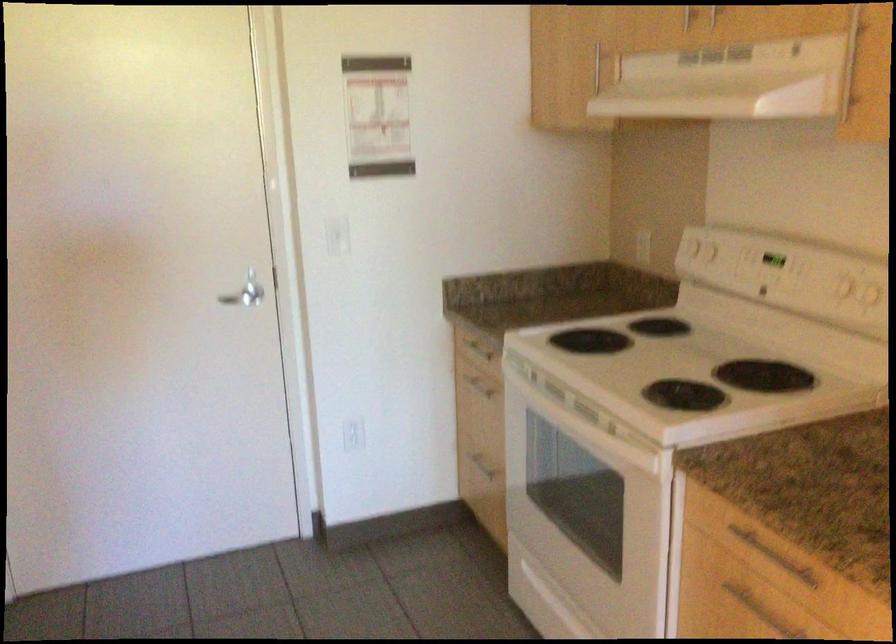
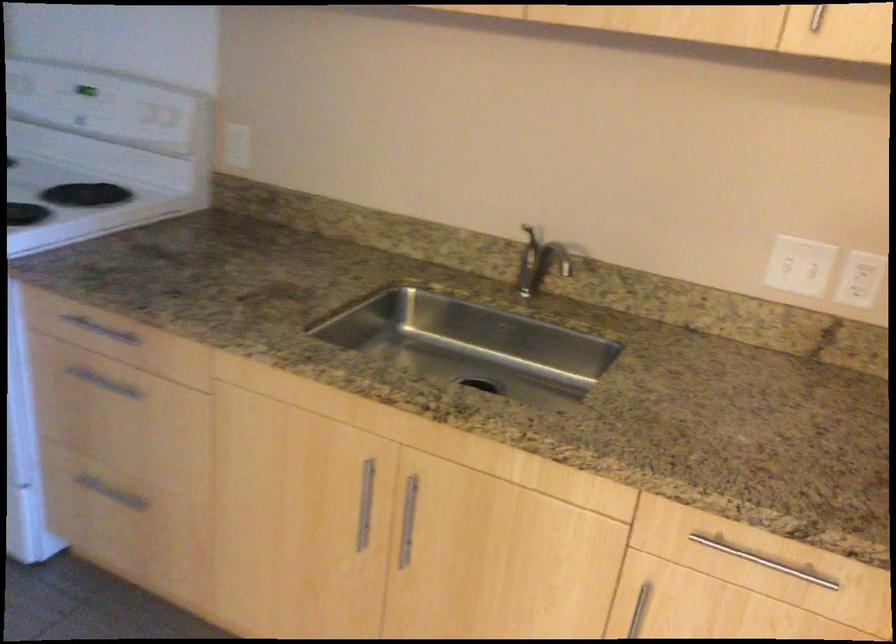
In the second image, find the point that corresponds to [771,252] in the first image.

(85, 90)